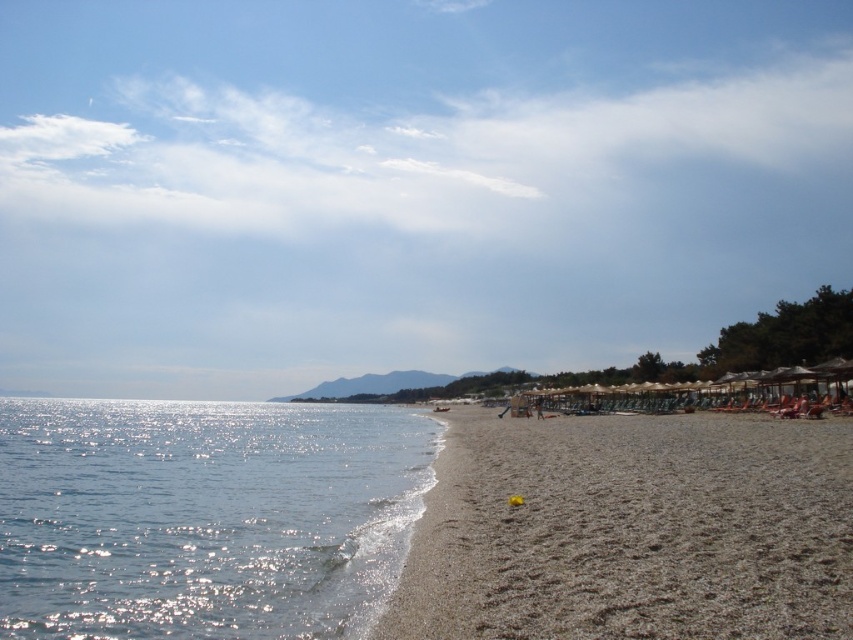
Between point (193, 3) and point (717, 545), which one is positioned in front?

Point (717, 545)

You are a GUI agent. You are given a task and a screenshot of the screen. Output one action in this format:
    pyautogui.click(x=<x>, y=<y>)
    Task: Click on the blue sky at upper center
    The width and height of the screenshot is (853, 640).
    Given the screenshot: What is the action you would take?
    pyautogui.click(x=405, y=186)

This screenshot has height=640, width=853. Identify the location of blue sky at upper center. (405, 186).

Can you confirm if shiny blue water at lower left is positioned below brown sandy beach at lower right?

Yes, shiny blue water at lower left is below brown sandy beach at lower right.

Does point (33, 426) come behind point (664, 552)?

Yes.

Where is `shiny blue water at lower left`? shiny blue water at lower left is located at coordinates (202, 516).

What are the coordinates of `blue sky at upper center` in the screenshot? It's located at (405, 186).

Does blue sky at upper center appear on the left side of shiny blue water at lower left?

Incorrect, blue sky at upper center is not on the left side of shiny blue water at lower left.

Who is more distant from viewer, (520, 74) or (257, 515)?

Point (520, 74)

You are a GUI agent. You are given a task and a screenshot of the screen. Output one action in this format:
    pyautogui.click(x=<x>, y=<y>)
    Task: Click on the blue sky at upper center
    This screenshot has width=853, height=640.
    Given the screenshot: What is the action you would take?
    pyautogui.click(x=405, y=186)